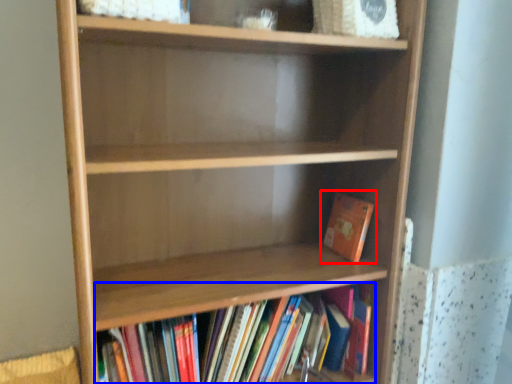
Question: Which point is further to the camera, book (highlighted by a red box) or book (highlighted by a blue box)?

Choices:
 (A) book
 (B) book

Answer: (A)